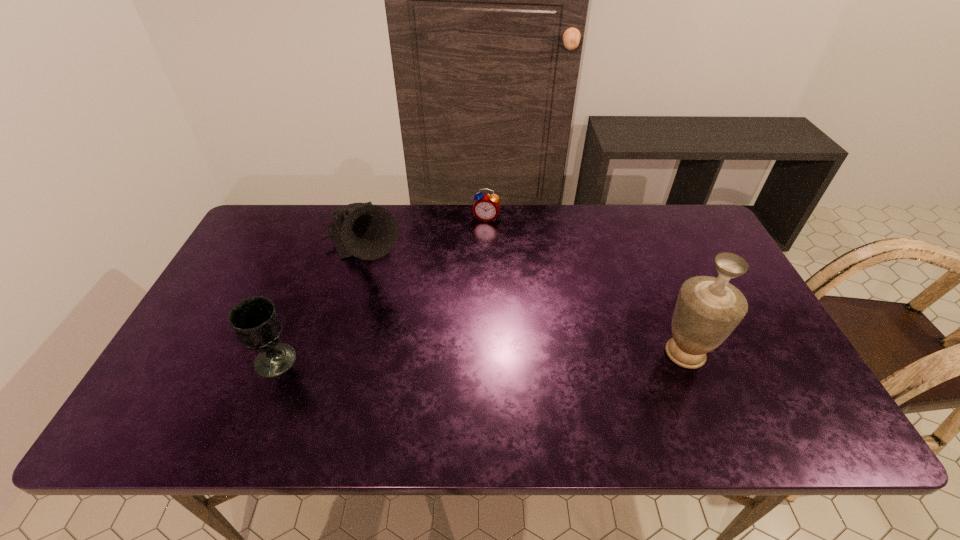
This screenshot has height=540, width=960. What are the coordinates of `vacant space positioned from the horn of the second tallest object` in the screenshot? It's located at (392, 320).

In order to click on vacant space positioned from the horn of the second tallest object in this screenshot , I will do `click(413, 362)`.

The width and height of the screenshot is (960, 540). What are the coordinates of `free space located 0.200m from the horn of the second tallest object` in the screenshot? It's located at (402, 341).

Where is `alarm clock at the far edge`? alarm clock at the far edge is located at coordinates (486, 207).

At what (x,y) coordinates should I click in order to perform the action: click on phonograph_record that is positioned at the far edge. Please return your answer as a coordinate pair (x, y). The width and height of the screenshot is (960, 540). Looking at the image, I should click on (366, 231).

The height and width of the screenshot is (540, 960). What are the coordinates of `chalice located at the near edge` in the screenshot? It's located at (255, 321).

Find the location of a particular element. urn at the near edge is located at coordinates (708, 309).

This screenshot has width=960, height=540. What are the coordinates of `vacant point at the far edge` in the screenshot? It's located at (555, 217).

In the image, there is a desktop. Identify the location of vacant area at the near edge. (648, 370).

Where is `free space at the left edge of the desktop`? The width and height of the screenshot is (960, 540). free space at the left edge of the desktop is located at coordinates (249, 282).